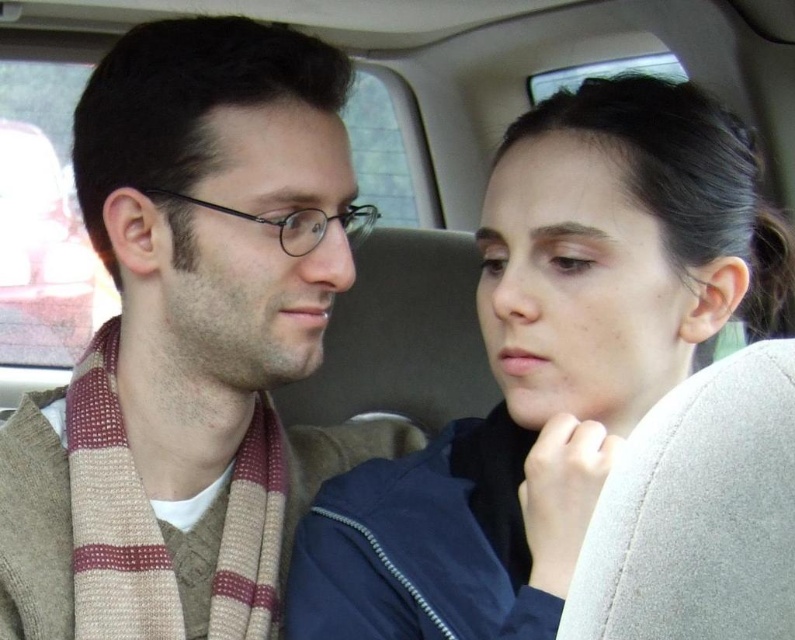
Question: Which of the following is the closest to the observer?

Choices:
 (A) (571, 458)
 (B) (145, 436)

Answer: (A)

Question: Is knitted scarf at left behind smooth navy blue jacket at center?

Choices:
 (A) yes
 (B) no

Answer: (A)

Question: Based on their relative distances, which object is farther from the smooth navy blue jacket at center?

Choices:
 (A) knitted scarf at left
 (B) gray fabric at upper right

Answer: (B)

Question: Among these objects, which one is nearest to the camera?

Choices:
 (A) knitted scarf at left
 (B) smooth navy blue jacket at center
 (C) gray fabric at upper right

Answer: (C)

Question: Does knitted scarf at left lie in front of smooth navy blue jacket at center?

Choices:
 (A) yes
 (B) no

Answer: (B)

Question: Does knitted scarf at left appear over smooth navy blue jacket at center?

Choices:
 (A) yes
 (B) no

Answer: (A)